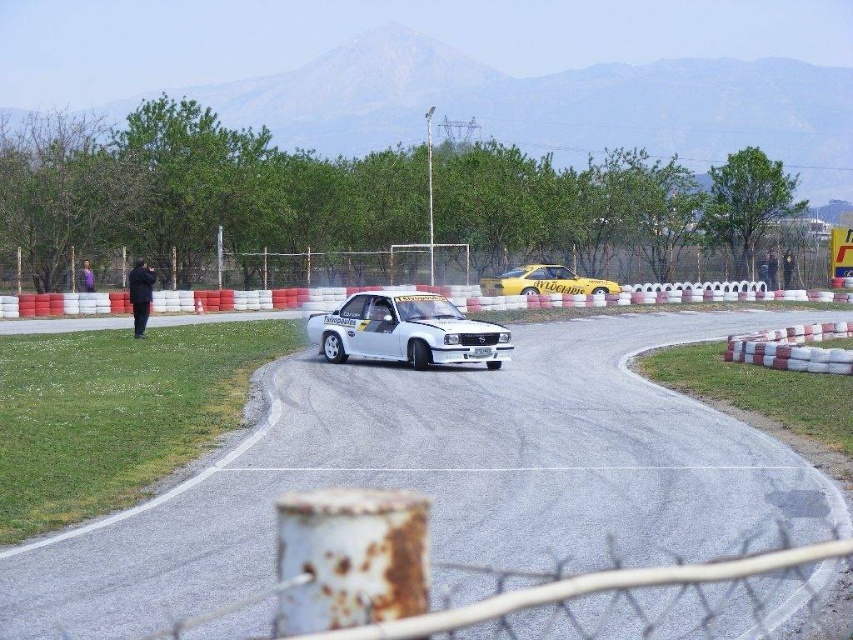
Based on the coordinates provided in the scene description, where is the white asphalt race track at center located?

The white asphalt race track at center is located at coordinates point (450,481).